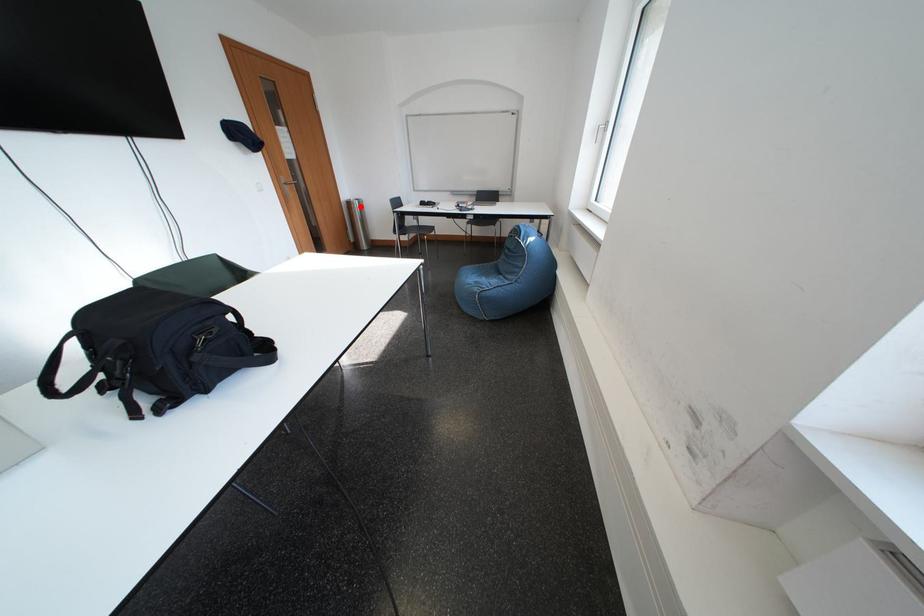
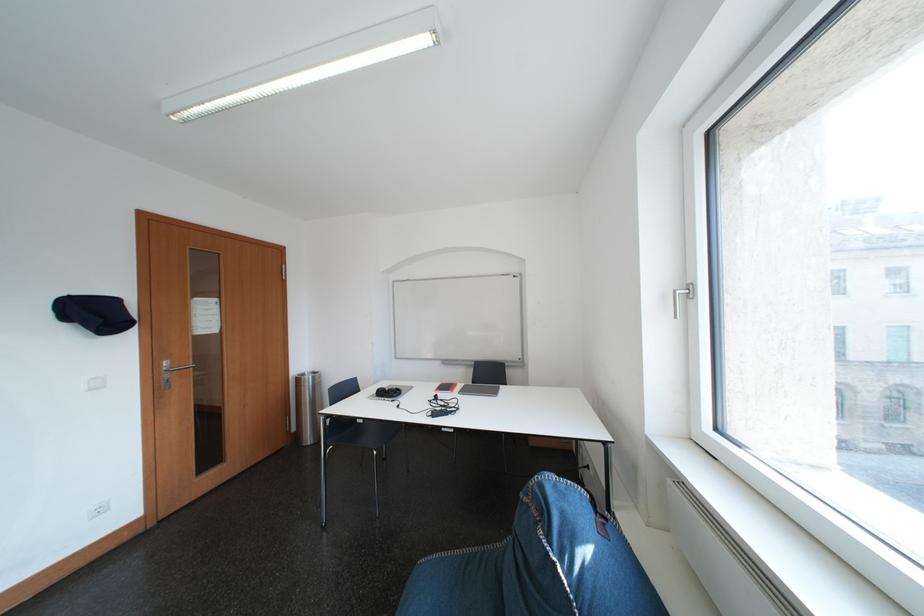
Question: I am providing you with two images of the same scene from different viewpoints. Image1 has a red point marked. In image2, the corresponding 3D location appears at what relative position? Reply with the corresponding letter.

Choices:
 (A) Closer
 (B) Farther

Answer: (B)